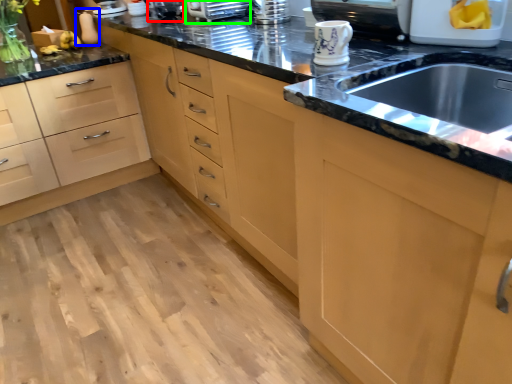
Question: Based on their relative distances, which object is farther from appliance (highlighted by a red box)? Choose from appliance (highlighted by a blue box) and appliance (highlighted by a green box).

Choices:
 (A) appliance
 (B) appliance

Answer: (A)